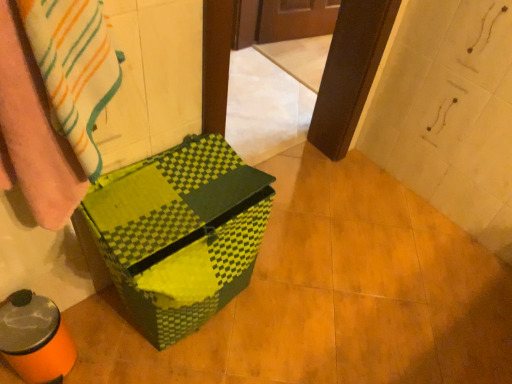
Question: Relative to striped cotton towel at left, is green checkered cardboard box at center in front or behind?

Choices:
 (A) front
 (B) behind

Answer: (B)

Question: From the image's perspective, relative to striped cotton towel at left, is green checkered cardboard box at center above or below?

Choices:
 (A) above
 (B) below

Answer: (B)

Question: Is green checkered cardboard box at center taller or shorter than striped cotton towel at left?

Choices:
 (A) short
 (B) tall

Answer: (B)

Question: From a real-world perspective, is striped cotton towel at left positioned above or below green checkered cardboard box at center?

Choices:
 (A) above
 (B) below

Answer: (A)

Question: From their relative heights in the image, would you say striped cotton towel at left is taller or shorter than green checkered cardboard box at center?

Choices:
 (A) short
 (B) tall

Answer: (A)

Question: Looking at the image, does striped cotton towel at left seem bigger or smaller compared to green checkered cardboard box at center?

Choices:
 (A) big
 (B) small

Answer: (B)

Question: Does point (58, 39) appear closer or farther from the camera than point (228, 223)?

Choices:
 (A) farther
 (B) closer

Answer: (B)